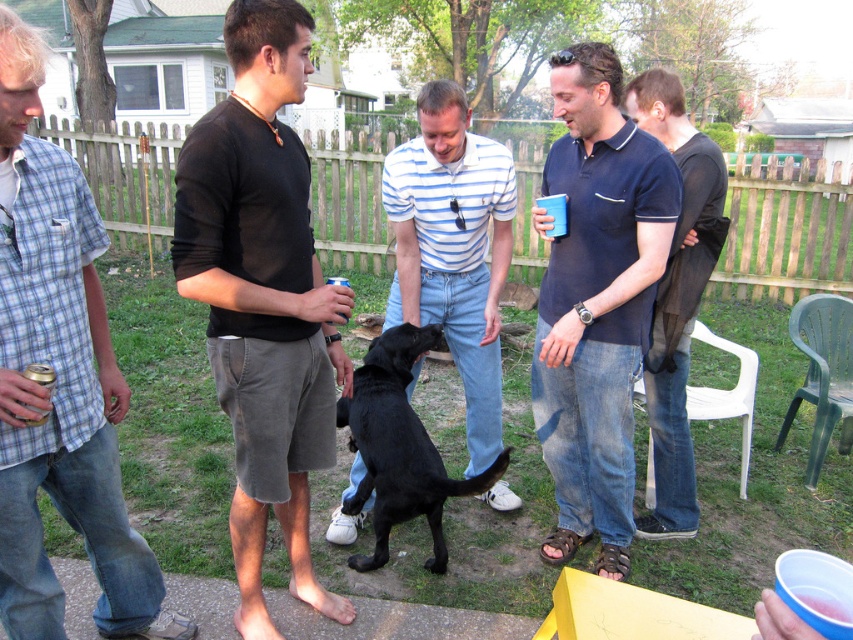
Question: Which point is closer to the camera?

Choices:
 (A) (207, 116)
 (B) (105, 356)
 (C) (537, 202)
 (D) (453, 230)

Answer: (A)

Question: Can you confirm if light blue plaid shirt at left is positioned below black smooth dog at center?

Choices:
 (A) no
 (B) yes

Answer: (A)

Question: Which point is closer to the camera taking this photo?

Choices:
 (A) (544, 209)
 (B) (44, 637)
 (C) (709, 177)

Answer: (B)

Question: Is navy blue polo shirt at center positioned before metallic silver can at center?

Choices:
 (A) yes
 (B) no

Answer: (B)

Question: Can you confirm if dark blue polo shirt at center is positioned to the right of black smooth dog at center?

Choices:
 (A) yes
 (B) no

Answer: (A)

Question: Which object appears farthest from the camera in this image?

Choices:
 (A) smooth black dog at center
 (B) light blue plaid shirt at left
 (C) metallic can at left

Answer: (A)